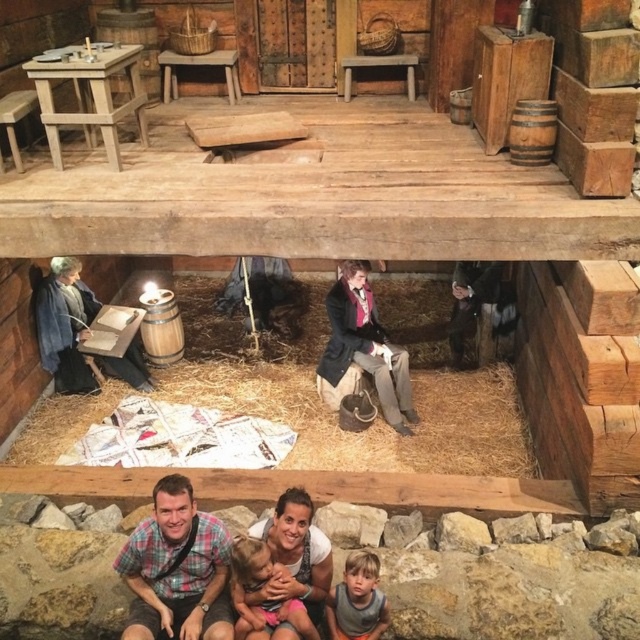
Question: Can you confirm if smooth brown coat at center is positioned below light brown hair at lower center?

Choices:
 (A) yes
 (B) no

Answer: (B)

Question: Can you confirm if plaid fabric shirt at lower center is positioned above smooth brown coat at center?

Choices:
 (A) yes
 (B) no

Answer: (B)

Question: Which object appears farthest from the camera in this image?

Choices:
 (A) plaid fabric shirt at lower center
 (B) soft pink fabric at lower center

Answer: (B)

Question: Which of the following is the farthest from the observer?

Choices:
 (A) soft pink fabric at lower center
 (B) light brown hair at lower center
 (C) smooth brown coat at center
 (D) plaid fabric shirt at lower center

Answer: (C)

Question: Which point is closer to the camera?

Choices:
 (A) smooth brown coat at center
 (B) light brown hair at lower center
 (C) plaid fabric shirt at lower center

Answer: (C)

Question: Does plaid fabric shirt at lower center have a larger size compared to soft pink fabric at lower center?

Choices:
 (A) yes
 (B) no

Answer: (A)